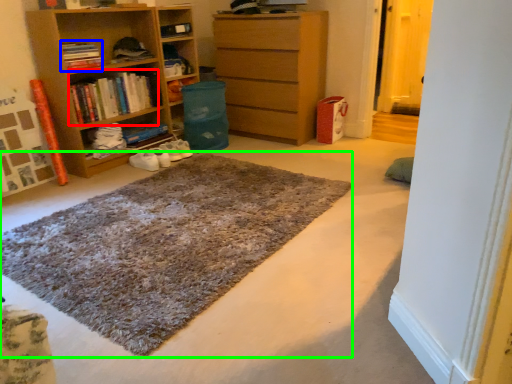
Question: Which object is positioned closest to book (highlighted by a red box)? Select from book (highlighted by a blue box) and doormat (highlighted by a green box).

Choices:
 (A) book
 (B) doormat

Answer: (A)